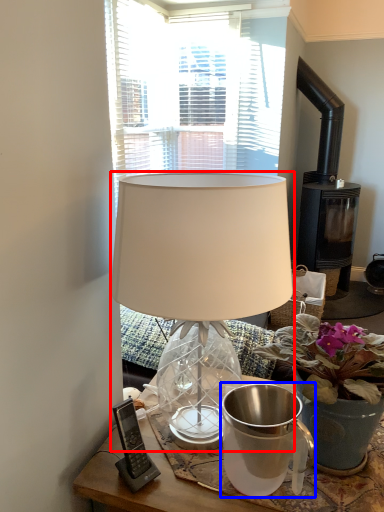
Question: Which object is further to the camera taking this photo, lamp (highlighted by a red box) or jug (highlighted by a blue box)?

Choices:
 (A) lamp
 (B) jug

Answer: (B)